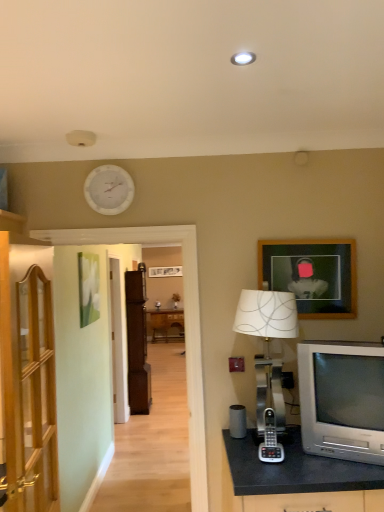
Question: Does silver metallic phone at center appear on the right side of silver metallic table lamp at right?

Choices:
 (A) yes
 (B) no

Answer: (B)

Question: Is silver metallic phone at center positioned beyond the bounds of silver metallic table lamp at right?

Choices:
 (A) no
 (B) yes

Answer: (A)

Question: From a real-world perspective, is silver metallic phone at center on top of silver metallic table lamp at right?

Choices:
 (A) no
 (B) yes

Answer: (A)

Question: Is there a large distance between silver metallic phone at center and silver metallic table lamp at right?

Choices:
 (A) yes
 (B) no

Answer: (B)

Question: Could you tell me if silver metallic phone at center is turned towards silver metallic table lamp at right?

Choices:
 (A) yes
 (B) no

Answer: (A)

Question: Is wooden picture frame at upper right bigger or smaller than silver metallic table lamp at right?

Choices:
 (A) small
 (B) big

Answer: (A)

Question: Is wooden picture frame at upper right wider or thinner than silver metallic table lamp at right?

Choices:
 (A) wide
 (B) thin

Answer: (B)

Question: Is wooden picture frame at upper right to the left or to the right of silver metallic table lamp at right in the image?

Choices:
 (A) right
 (B) left

Answer: (A)

Question: From the image's perspective, is wooden picture frame at upper right located above or below silver metallic table lamp at right?

Choices:
 (A) below
 (B) above

Answer: (B)

Question: Based on their positions, is brown wood cabinet at center, arranged as the second cabinetry when viewed from the front, located to the left or right of white matte clock at upper center?

Choices:
 (A) right
 (B) left

Answer: (B)

Question: Is brown wood cabinet at center, arranged as the second cabinetry when viewed from the front, situated inside white matte clock at upper center or outside?

Choices:
 (A) outside
 (B) inside

Answer: (A)

Question: Considering the positions of brown wood cabinet at center, which is counted as the first cabinetry, starting from the back, and white matte clock at upper center in the image, is brown wood cabinet at center, which is counted as the first cabinetry, starting from the back, taller or shorter than white matte clock at upper center?

Choices:
 (A) tall
 (B) short

Answer: (A)

Question: Is point (137, 290) positioned closer to the camera than point (96, 192)?

Choices:
 (A) farther
 (B) closer

Answer: (A)

Question: In the image, is wooden cabinet at left, which appears as the 2th cabinetry when viewed from the back, on the left side or the right side of white matte clock at upper center?

Choices:
 (A) right
 (B) left

Answer: (B)

Question: Is point (46, 304) positioned closer to the camera than point (124, 208)?

Choices:
 (A) farther
 (B) closer

Answer: (B)